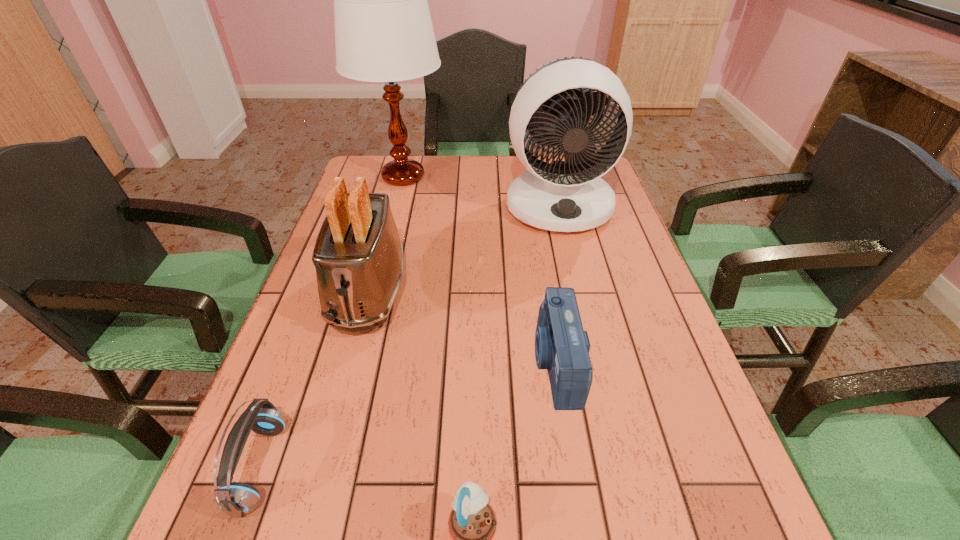
In the image, there is a desktop. Identify the location of vacant space at the far edge. (480, 162).

Where is `free location at the left edge of the desktop`? free location at the left edge of the desktop is located at coordinates (332, 338).

In the image, there is a desktop. Identify the location of blank space at the right edge. The width and height of the screenshot is (960, 540). (684, 460).

In order to click on vacant point located between the toaster and the camera in this screenshot , I will do `click(463, 328)`.

This screenshot has height=540, width=960. Identify the location of free area in between the fan and the camera. click(557, 284).

Locate an element on the screen. The width and height of the screenshot is (960, 540). vacant space that is in between the fan and the third tallest object is located at coordinates (464, 248).

Image resolution: width=960 pixels, height=540 pixels. I want to click on free space between the fifth shortest object and the toaster, so click(464, 248).

Identify the location of free space between the headset and the camera. (408, 415).

You are a GUI agent. You are given a task and a screenshot of the screen. Output one action in this format:
    pyautogui.click(x=<x>, y=<y>)
    Task: Click on the vacant area that lies between the second tallest object and the tallest object
    The height and width of the screenshot is (540, 960).
    Given the screenshot: What is the action you would take?
    pyautogui.click(x=481, y=191)

At what (x,y) coordinates should I click in order to perform the action: click on free spot between the third tallest object and the headset. Please return your answer as a coordinate pair (x, y). Looking at the image, I should click on (314, 380).